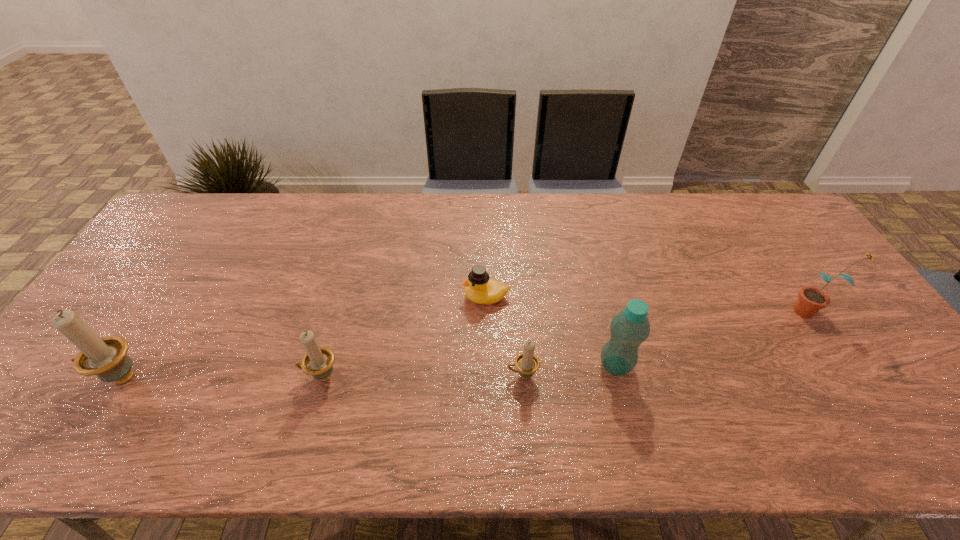
The height and width of the screenshot is (540, 960). Find the location of `vacant spot to place a candle_holder on the right`. vacant spot to place a candle_holder on the right is located at coordinates (723, 375).